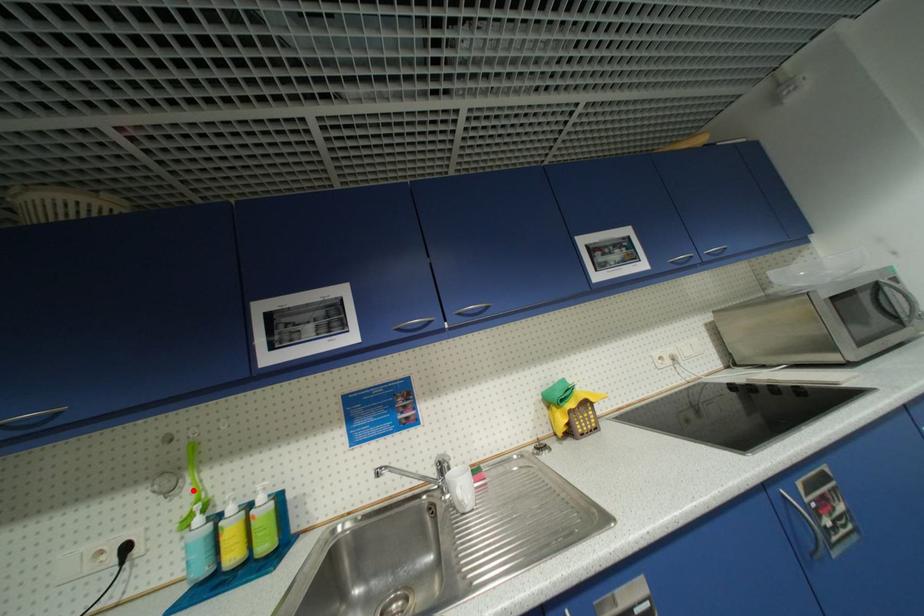
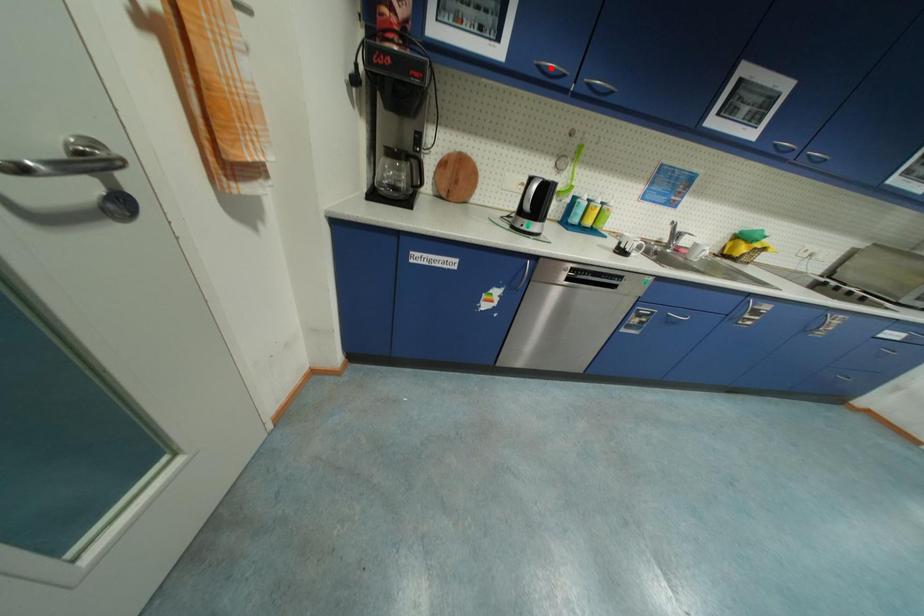
I am providing you with two images of the same scene from different viewpoints. A red point is marked on the first image and another point is marked on the second image. Do the highlighted points in image1 and image2 indicate the same real-world spot?

No